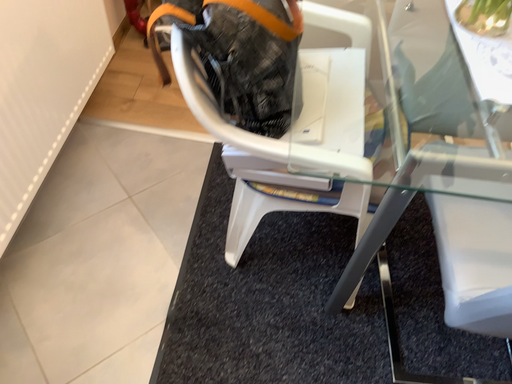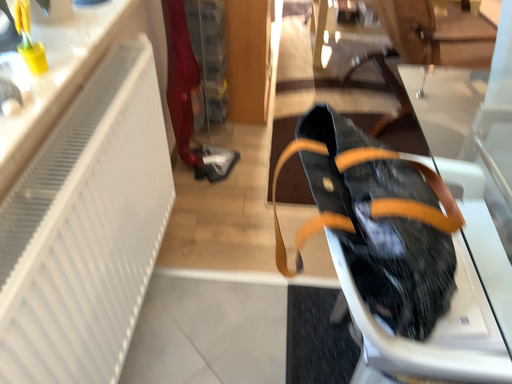
Question: Which way did the camera rotate in the video?

Choices:
 (A) rotated upward
 (B) rotated downward

Answer: (A)